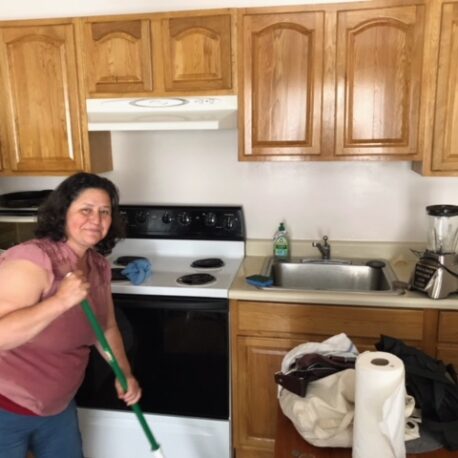
This screenshot has height=458, width=458. I want to click on glass oven door, so click(x=186, y=364).